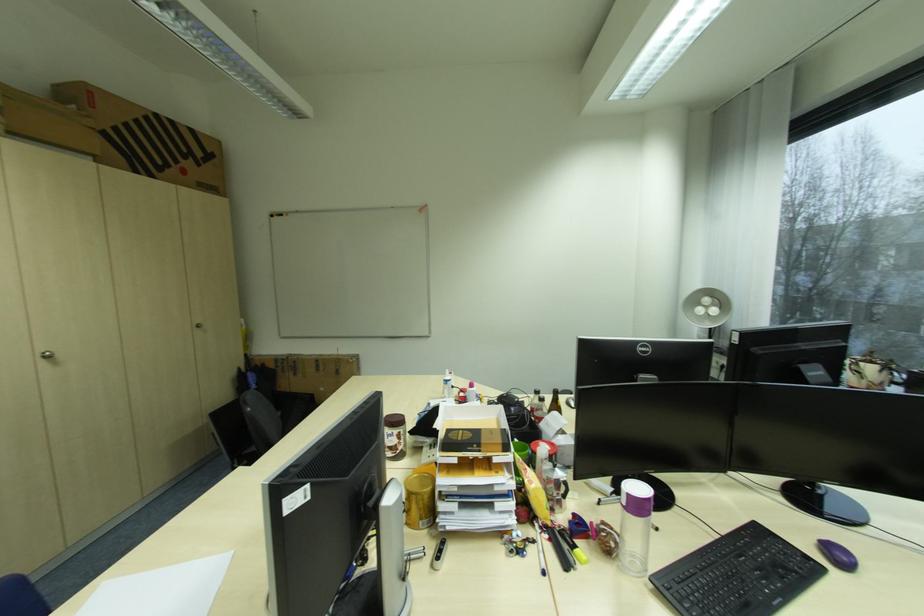
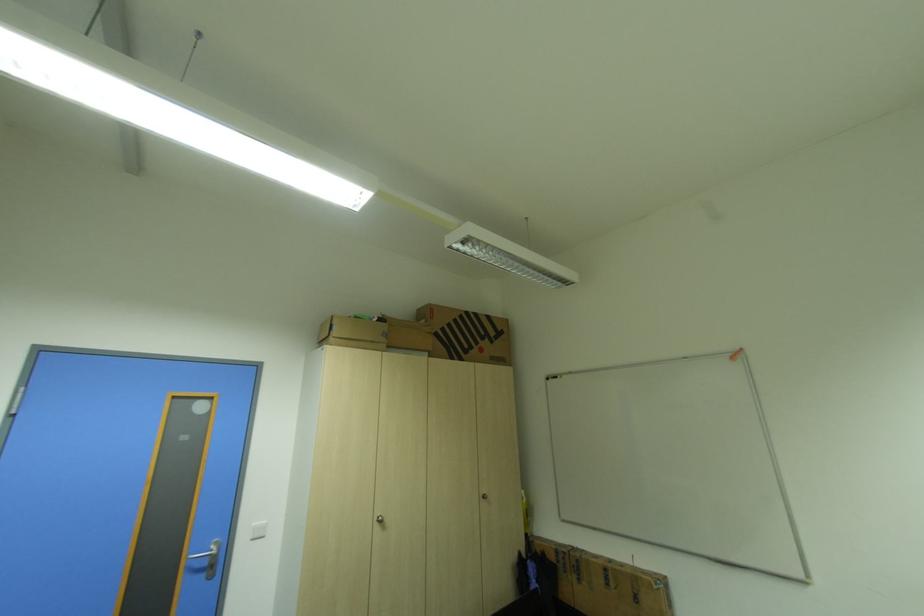
How did the camera likely rotate?

The camera's rotation is toward left-up.